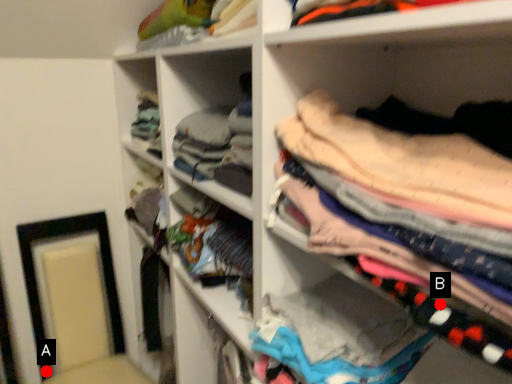
Question: Two points are circled on the image, labeled by A and B beside each circle. Which point appears closest to the camera in this image?

Choices:
 (A) A is closer
 (B) B is closer

Answer: (B)